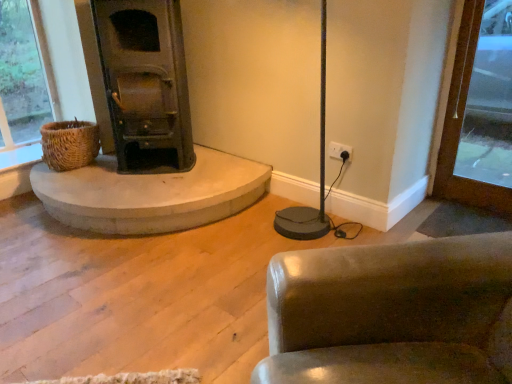
Where is `unoccupied area in front of brown wood door at right`? This screenshot has width=512, height=384. unoccupied area in front of brown wood door at right is located at coordinates (478, 215).